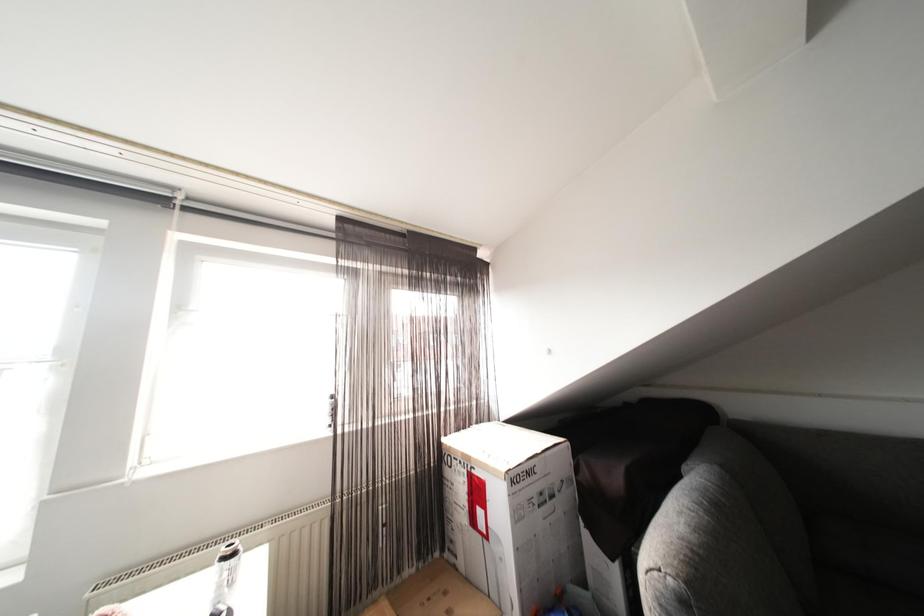
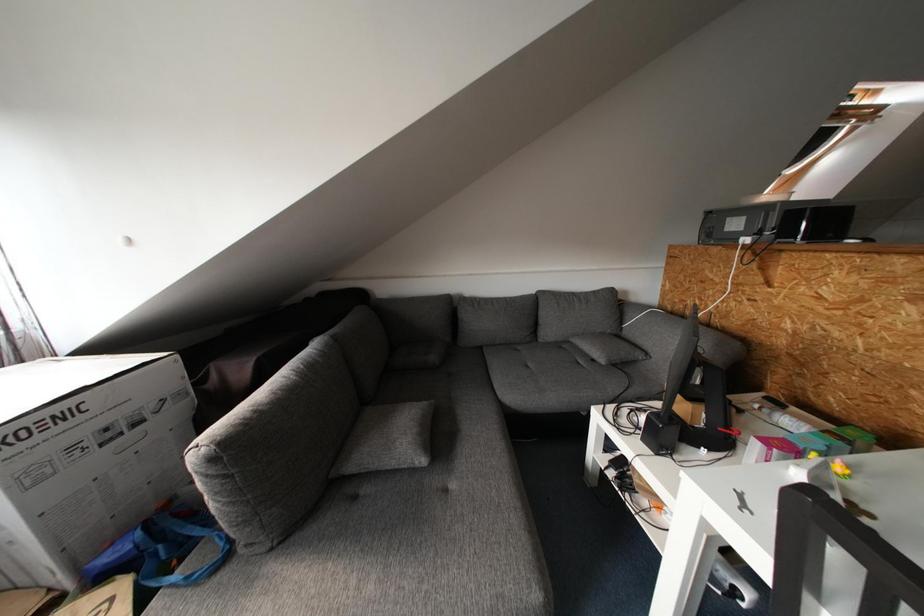
Based on the continuous images, in which direction is the camera rotating?

The camera rotated toward right-down.